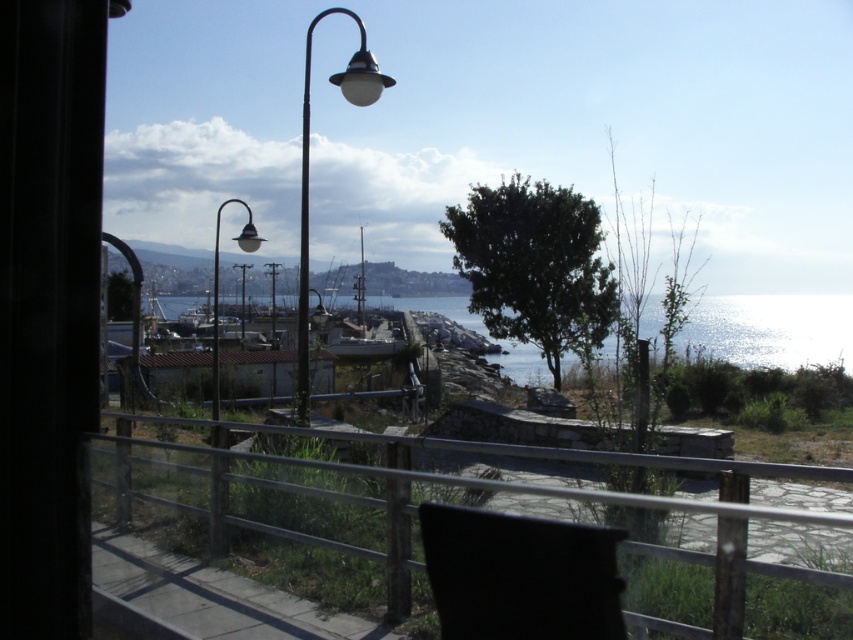
Is metallic gray ship at center shorter than metallic street light at left?

Indeed, metallic gray ship at center has a lesser height compared to metallic street light at left.

Is point (335, 340) in front of point (235, 237)?

Yes, it is in front of point (235, 237).

Between point (347, 328) and point (212, 364), which one is positioned in front?

Point (212, 364)

Locate an element on the screen. metallic gray ship at center is located at coordinates (361, 326).

Does black plastic chair at lower center appear on the left side of metallic gray ship at center?

No, black plastic chair at lower center is not to the left of metallic gray ship at center.

Which is behind, point (538, 596) or point (364, 353)?

The point (364, 353) is more distant.

Locate an element on the screen. Image resolution: width=853 pixels, height=640 pixels. black plastic chair at lower center is located at coordinates (520, 576).

Which is in front, point (650, 611) or point (216, 392)?

Point (650, 611) is more forward.

Identify the location of metallic silver rail at center. The image size is (853, 640). (416, 512).